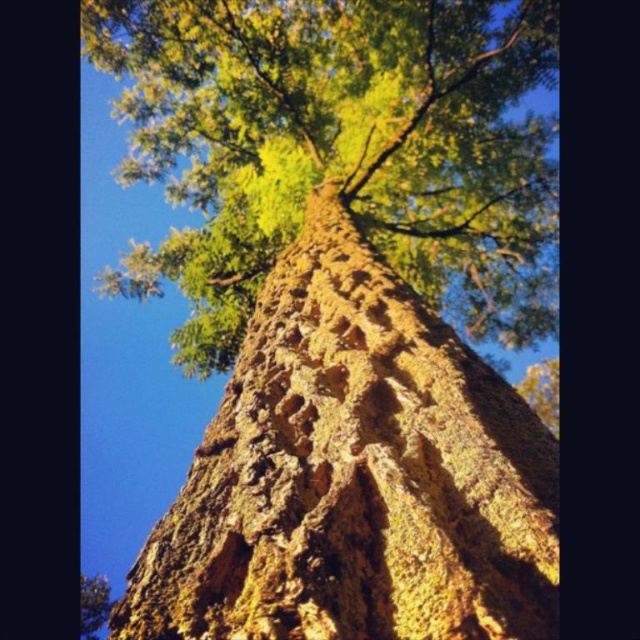
Question: Which object is closer to the camera taking this photo?

Choices:
 (A) rough textured bark at center
 (B) green mossy bark at center

Answer: (B)

Question: Does green mossy bark at center appear over rough textured bark at center?

Choices:
 (A) yes
 (B) no

Answer: (B)

Question: From the image, what is the correct spatial relationship of green mossy bark at center in relation to rough textured bark at center?

Choices:
 (A) below
 (B) above

Answer: (A)

Question: Which point is farther from the camera taking this photo?

Choices:
 (A) (385, 29)
 (B) (524, 548)

Answer: (A)

Question: Is green mossy bark at center closer to camera compared to rough textured bark at center?

Choices:
 (A) no
 (B) yes

Answer: (B)